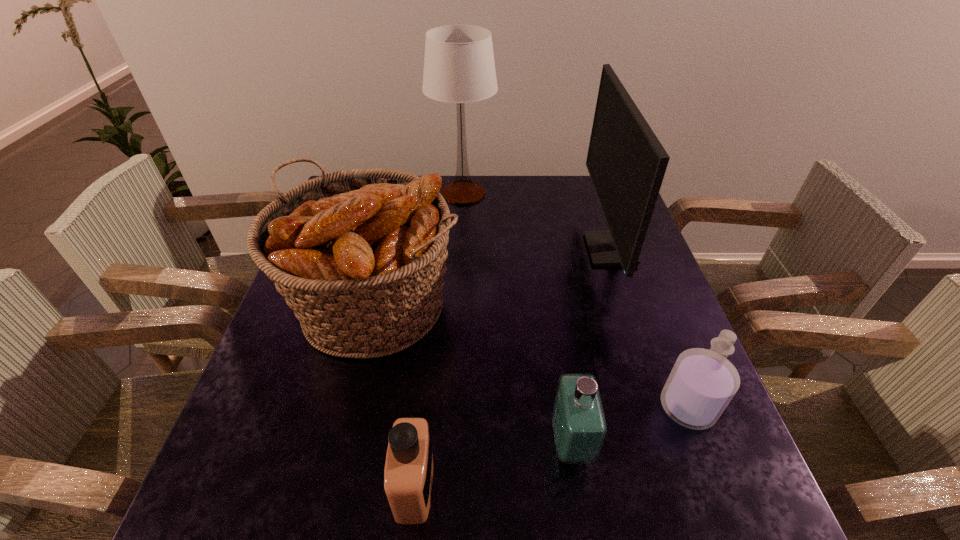
Where is `vacant space that is in between the rightmost perfume and the leftmost perfume`? The image size is (960, 540). vacant space that is in between the rightmost perfume and the leftmost perfume is located at coordinates (551, 446).

Image resolution: width=960 pixels, height=540 pixels. I want to click on vacant space in between the leftmost perfume and the basket, so click(x=396, y=396).

Identify the location of empty space between the table lamp and the rightmost perfume. This screenshot has height=540, width=960. click(575, 300).

The height and width of the screenshot is (540, 960). In order to click on free space between the basket and the second perfume from right to left in this screenshot , I will do `click(473, 375)`.

Where is `free point between the rightmost perfume and the third object from right to left`? free point between the rightmost perfume and the third object from right to left is located at coordinates (629, 425).

Where is `object that is the fourth closest to the rightmost perfume`? object that is the fourth closest to the rightmost perfume is located at coordinates (408, 475).

Select which object is the second closest to the third object from right to left. Please provide its 2D coordinates. Your answer should be formatted as a tuple, i.e. [(x, y)], where the tuple contains the x and y coordinates of a point satisfying the conditions above.

[(360, 255)]

Locate an element on the screen. The image size is (960, 540). perfume identified as the second closest to the leftmost perfume is located at coordinates (702, 383).

This screenshot has width=960, height=540. Find the location of `perfume that is the closest to the computer monitor`. perfume that is the closest to the computer monitor is located at coordinates tap(702, 383).

The height and width of the screenshot is (540, 960). In order to click on free location that satisfies the following two spatial constraints: 1. above the cylindrical shade of the table lamp; 2. on the front side of the fourth shortest object in this screenshot , I will do `click(457, 306)`.